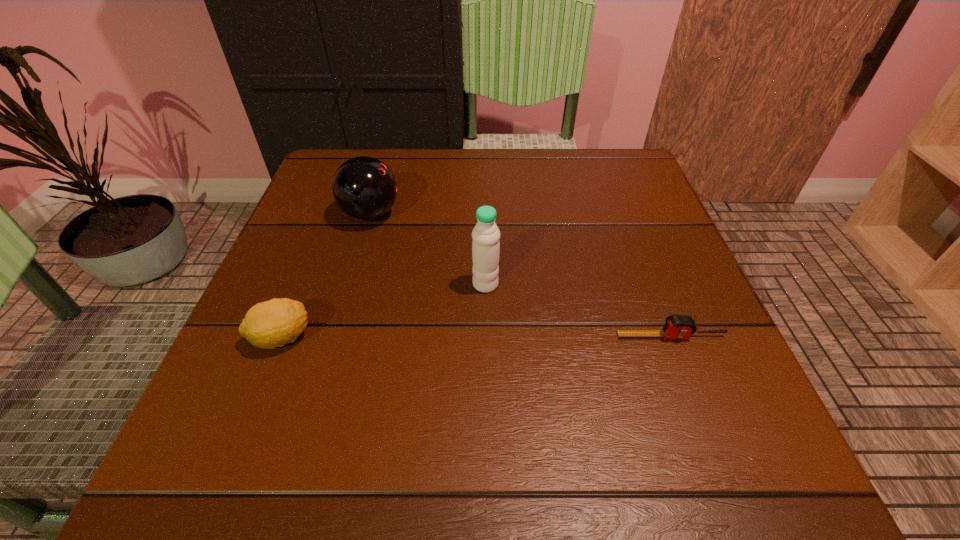
At what (x,y) coordinates should I click in order to perform the action: click on free space at the near left corner of the desktop. Please return your answer as a coordinate pair (x, y). The height and width of the screenshot is (540, 960). Looking at the image, I should click on (191, 477).

I want to click on free location at the far right corner of the desktop, so click(649, 191).

What are the coordinates of `free space at the near right corner of the desktop` in the screenshot? It's located at (765, 489).

This screenshot has height=540, width=960. Find the location of `free point between the shortest object and the farthest object`. free point between the shortest object and the farthest object is located at coordinates (520, 275).

This screenshot has width=960, height=540. Identify the location of free spot between the tape measure and the third tallest object. (476, 337).

Find the location of a particular element. The width and height of the screenshot is (960, 540). free space that is in between the second object from right to left and the lemon is located at coordinates (383, 311).

Image resolution: width=960 pixels, height=540 pixels. I want to click on free space between the water bottle and the lemon, so click(383, 311).

This screenshot has height=540, width=960. I want to click on free spot between the tallest object and the second shortest object, so click(x=383, y=311).

Identify the location of vacant area that lies between the second tallest object and the lemon. (325, 276).

At what (x,y) coordinates should I click in order to perform the action: click on free space between the second farthest object and the lemon. Please return your answer as a coordinate pair (x, y). Looking at the image, I should click on (383, 311).